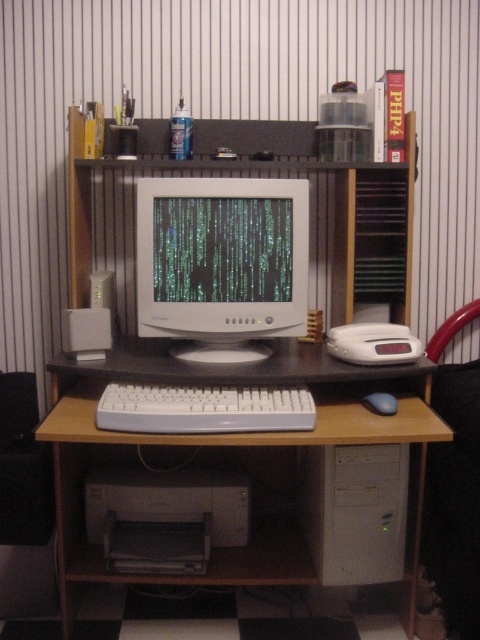
Question: Is white plastic computer tower at lower center smaller than black matte mouse at lower center?

Choices:
 (A) no
 (B) yes

Answer: (A)

Question: Does white glossy monitor at center have a smaller size compared to white plastic computer tower at lower center?

Choices:
 (A) no
 (B) yes

Answer: (A)

Question: Can you confirm if white plastic computer tower at lower center is smaller than white plastic keyboard at center?

Choices:
 (A) no
 (B) yes

Answer: (A)

Question: Estimate the real-world distances between objects in this image. Which object is farther from the black matte mouse at lower center?

Choices:
 (A) white plastic computer tower at lower center
 (B) white glossy monitor at center
 (C) white plastic keyboard at center

Answer: (B)

Question: Which point appears farthest from the camera in this image?

Choices:
 (A) (288, 577)
 (B) (202, 394)
 (C) (363, 493)
 (D) (235, 273)

Answer: (D)

Question: Considering the real-world distances, which object is farthest from the white plastic keyboard at center?

Choices:
 (A) black matte mouse at lower center
 (B) white plastic computer tower at lower center
 (C) white glossy monitor at center

Answer: (A)